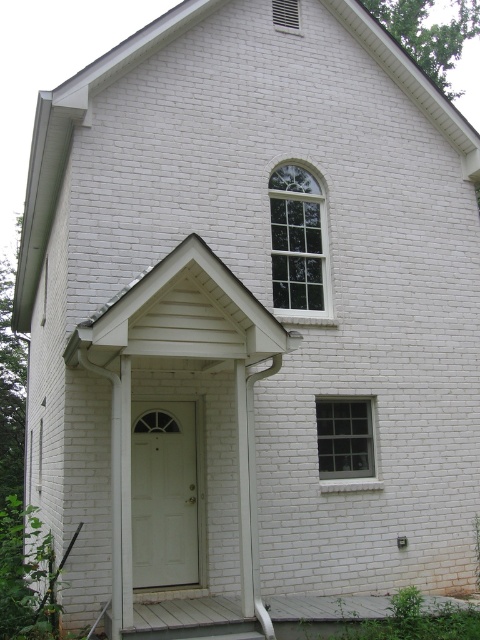
Which is in front, point (176, 493) or point (314, 624)?

Positioned in front is point (314, 624).

How much distance is there between white glossy door at center and white wooden porch at lower center?

white glossy door at center and white wooden porch at lower center are 2.03 meters apart.

Locate an element on the screen. This screenshot has width=480, height=640. white glossy door at center is located at coordinates (164, 493).

Can you confirm if white wooden porch at lower center is positioned above clear glass window at upper center?

Actually, white wooden porch at lower center is below clear glass window at upper center.

Does white wooden porch at lower center appear on the right side of clear glass window at upper center?

Correct, you'll find white wooden porch at lower center to the right of clear glass window at upper center.

Does point (229, 616) come farther from viewer compared to point (271, 204)?

No, it is not.

The image size is (480, 640). I want to click on white wooden porch at lower center, so tap(190, 618).

Who is taller, white wooden porch at lower center or clear glass window at center right?

clear glass window at center right

Does white wooden porch at lower center appear under clear glass window at center right?

Yes, white wooden porch at lower center is below clear glass window at center right.

Locate an element on the screen. The width and height of the screenshot is (480, 640). white wooden porch at lower center is located at coordinates (190, 618).